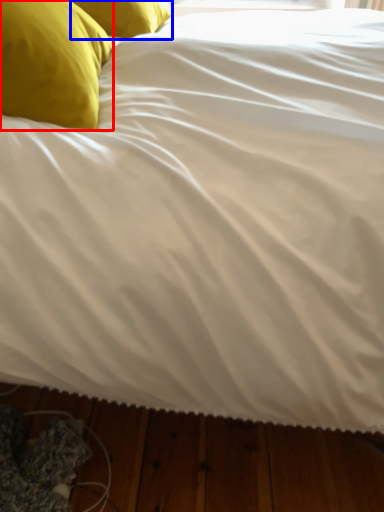
Question: Among these objects, which one is nearest to the camera, pillow (highlighted by a red box) or pillow (highlighted by a blue box)?

Choices:
 (A) pillow
 (B) pillow

Answer: (A)